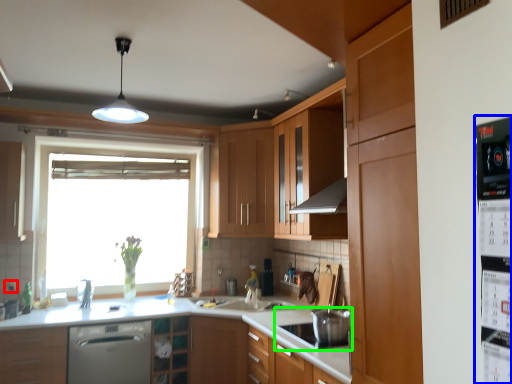
Question: Based on their relative distances, which object is nearer to electric outlet (highlighted by a red box)? Choose from appliance (highlighted by a blue box) and kitchen appliance (highlighted by a green box).

Choices:
 (A) appliance
 (B) kitchen appliance

Answer: (B)